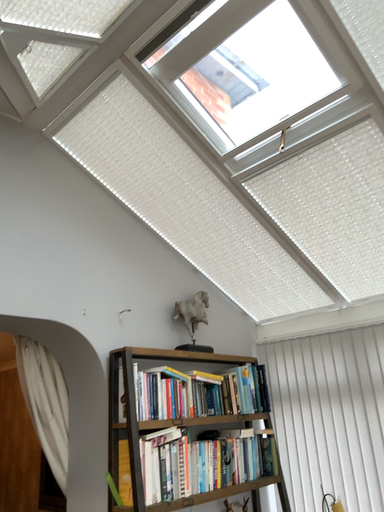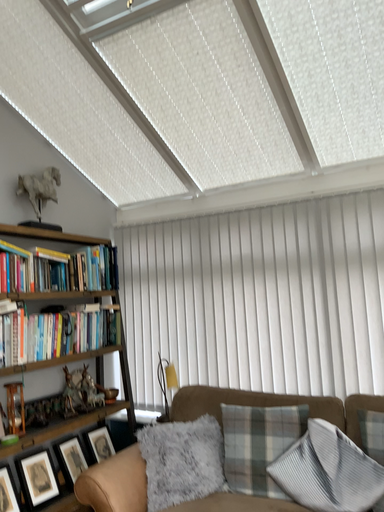
Question: How did the camera likely rotate when shooting the video?

Choices:
 (A) rotated right
 (B) rotated left

Answer: (A)